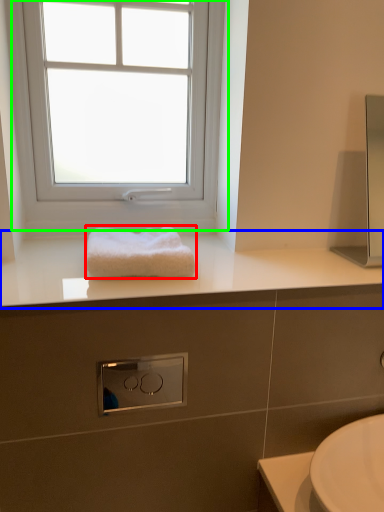
Question: Estimate the real-world distances between objects in this image. Which object is closer to towel (highlighted by a red box), countertop (highlighted by a blue box) or window (highlighted by a green box)?

Choices:
 (A) countertop
 (B) window

Answer: (A)